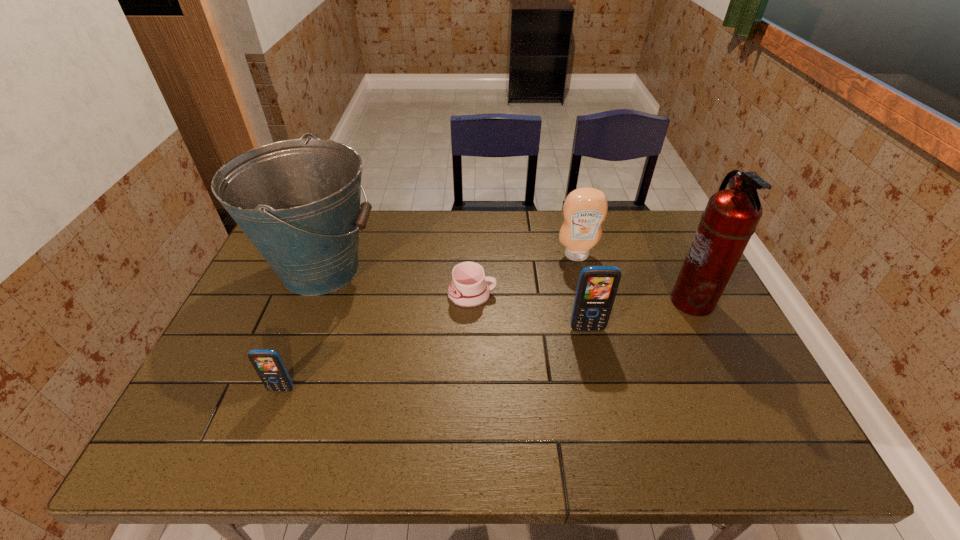
This screenshot has height=540, width=960. In order to click on the nearest object in this screenshot , I will do `click(268, 364)`.

At what (x,y) coordinates should I click in order to perform the action: click on the left cellular telephone. Please return your answer as a coordinate pair (x, y). Image resolution: width=960 pixels, height=540 pixels. Looking at the image, I should click on 268,364.

Identify the location of the right cellular telephone. (597, 286).

Locate an element on the screen. the taller cellular telephone is located at coordinates (597, 286).

What are the coordinates of `bucket` in the screenshot? It's located at (298, 201).

Where is `the tallest object`? the tallest object is located at coordinates (730, 218).

Image resolution: width=960 pixels, height=540 pixels. I want to click on the rightmost object, so click(730, 218).

The width and height of the screenshot is (960, 540). Find the location of `condiment`. condiment is located at coordinates (584, 210).

This screenshot has width=960, height=540. Find the location of `the third object from left to right`. the third object from left to right is located at coordinates (468, 288).

This screenshot has width=960, height=540. I want to click on the shortest object, so click(468, 288).